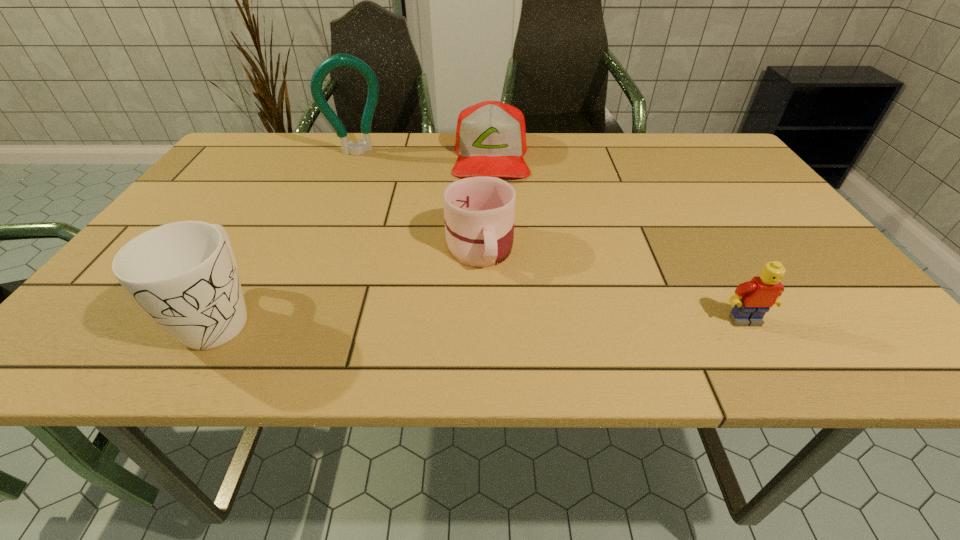
At what (x,y) coordinates should I click in order to perform the action: click on free point between the tallest object and the baseball cap. Please return your answer as a coordinate pair (x, y). This screenshot has width=960, height=540. Looking at the image, I should click on (424, 154).

Find the location of a particular element. The height and width of the screenshot is (540, 960). object that is the closest one to the shorter mug is located at coordinates (491, 136).

Find the location of a particular element. The height and width of the screenshot is (540, 960). the third closest object relative to the baseball cap is located at coordinates (184, 275).

Image resolution: width=960 pixels, height=540 pixels. What are the coordinates of `free spot that satisfies the following two spatial constraints: 1. on the back side of the baseball cap; 2. on the left side of the right mug` in the screenshot? It's located at (480, 156).

Where is `vacant space that satisfies the following two spatial constraints: 1. on the front side of the right mug; 2. on the left side of the tallest object`? Image resolution: width=960 pixels, height=540 pixels. vacant space that satisfies the following two spatial constraints: 1. on the front side of the right mug; 2. on the left side of the tallest object is located at coordinates (318, 246).

Identify the location of vacant position in the image that satisfies the following two spatial constraints: 1. on the front side of the tallest object; 2. on the right side of the shorter mug. (318, 246).

This screenshot has height=540, width=960. I want to click on vacant region that satisfies the following two spatial constraints: 1. on the front side of the right mug; 2. on the right side of the tallest object, so click(x=318, y=246).